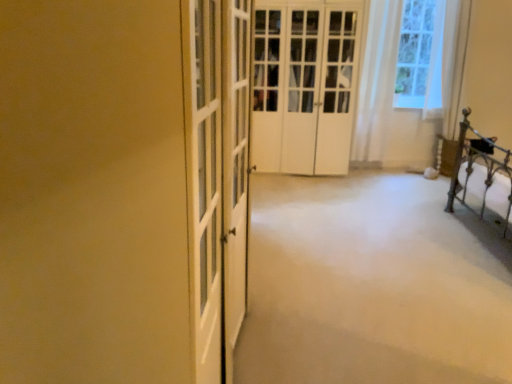
At what (x,y) coordinates should I click in order to perform the action: click on vacant location below white sheer curtain at upper right (from a real-world perspective). Please return your answer as a coordinate pair (x, y). Looking at the image, I should click on (371, 173).